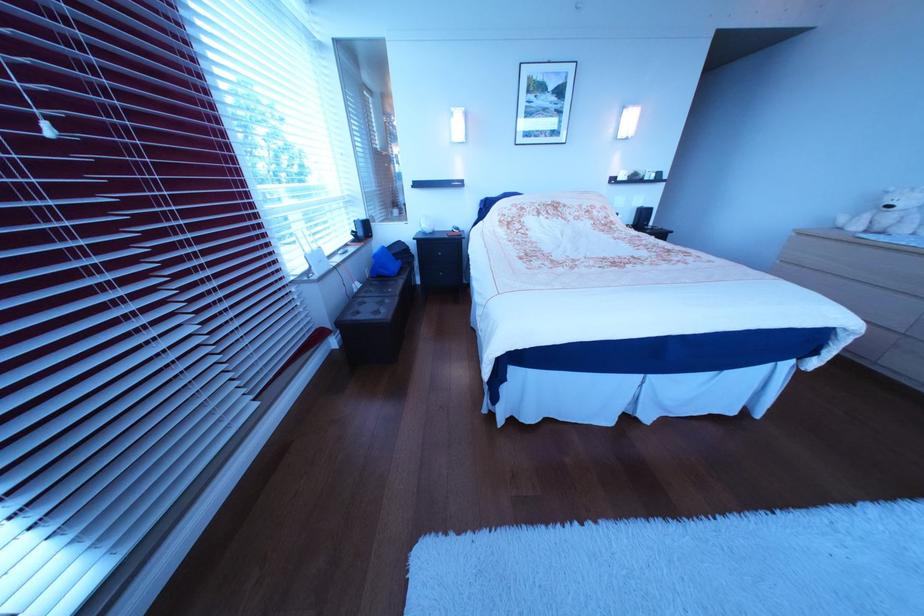
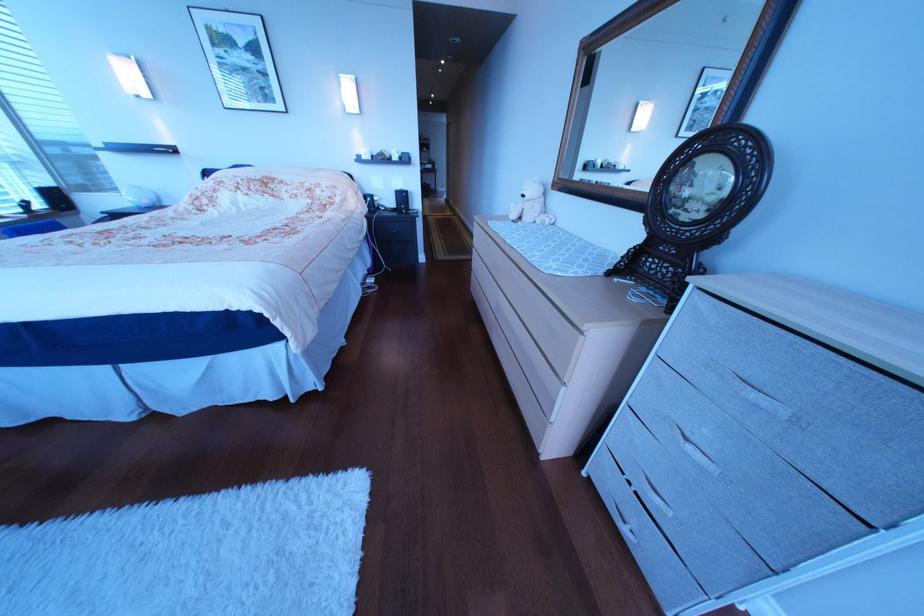
Question: The images are taken continuously from a first-person perspective. In which direction are you moving?

Choices:
 (A) Left
 (B) Right
 (C) Forward
 (D) Backward

Answer: (B)